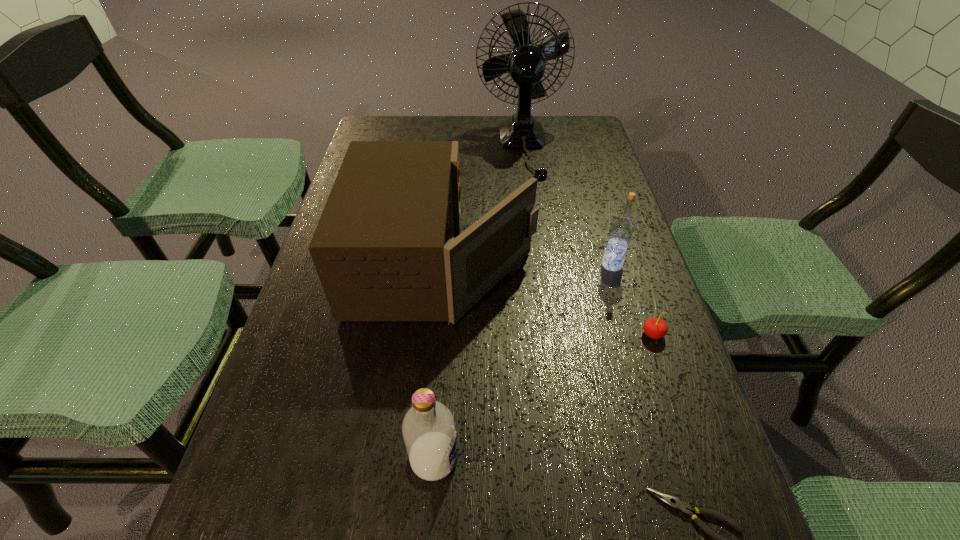
Locate an element on the screen. The height and width of the screenshot is (540, 960). vacant area situated on the label of the nearer vodka is located at coordinates (521, 458).

The height and width of the screenshot is (540, 960). I want to click on free space located on the left of the cherry, so click(576, 334).

Where is `object positioned at the far edge`? object positioned at the far edge is located at coordinates (526, 65).

Where is `object that is at the left edge`? object that is at the left edge is located at coordinates (384, 249).

You are a GUI agent. You are given a task and a screenshot of the screen. Output one action in this format:
    pyautogui.click(x=<x>, y=<y>)
    Task: Click on the fan that is at the right edge
    
    Given the screenshot: What is the action you would take?
    pyautogui.click(x=526, y=65)

Identify the location of vodka situated at the right edge. The height and width of the screenshot is (540, 960). (622, 228).

You are a GUI agent. You are given a task and a screenshot of the screen. Output one action in this format:
    pyautogui.click(x=<x>, y=<y>)
    Task: Click on the cherry situated at the right edge
    
    Given the screenshot: What is the action you would take?
    pyautogui.click(x=655, y=328)

Find the location of `object that is at the far right corner`. object that is at the far right corner is located at coordinates 526,65.

The height and width of the screenshot is (540, 960). I want to click on free space at the far edge, so click(433, 126).

In the image, there is a desktop. At what (x,y) coordinates should I click in order to perform the action: click on free space at the left edge. Please return your answer as a coordinate pair (x, y). Looking at the image, I should click on (352, 397).